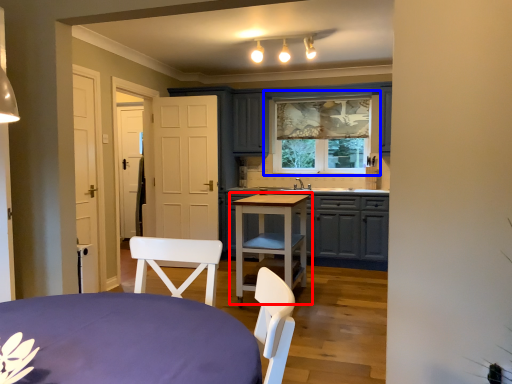
Question: Which of the following is the farthest to the observer, table (highlighted by a red box) or window (highlighted by a blue box)?

Choices:
 (A) table
 (B) window

Answer: (B)